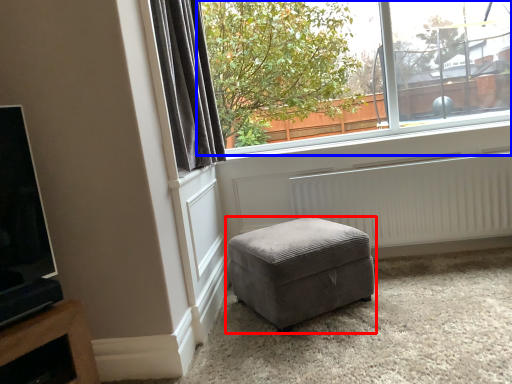
Question: Among these objects, which one is farthest to the camera, studio couch (highlighted by a red box) or window (highlighted by a blue box)?

Choices:
 (A) studio couch
 (B) window

Answer: (B)